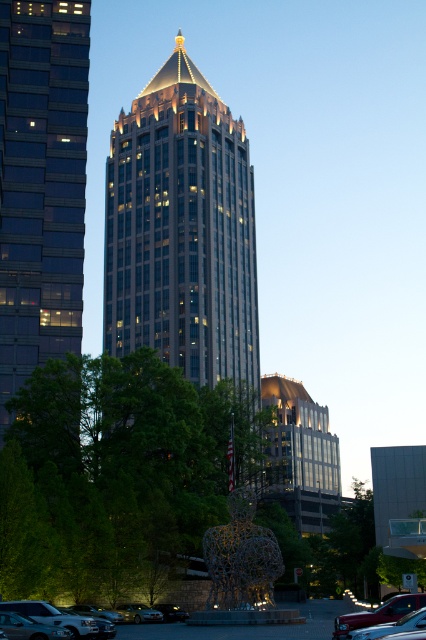
In the scene shown: You are a photographer planning to take a photo of the shiny glass skyscraper at center and the shiny silver sedan at lower left. Which object should you focus on first if you want to capture both in a single frame without moving the camera?

The shiny glass skyscraper at center is bigger than the shiny silver sedan at lower left, so you should focus on the shiny glass skyscraper at center first to ensure it fills the frame appropriately before adjusting for the smaller sedan.

You are a delivery driver who needs to park your truck between the metallic gray cars at lower center and the shiny silver sedan at lower left. Your truck is 10 meters long. Can you fit your truck between them without moving any existing vehicles?

The distance between the metallic gray cars at lower center and the shiny silver sedan at lower left is 12.31 meters. Since your truck is 10 meters long, it can fit between them as there is enough space.